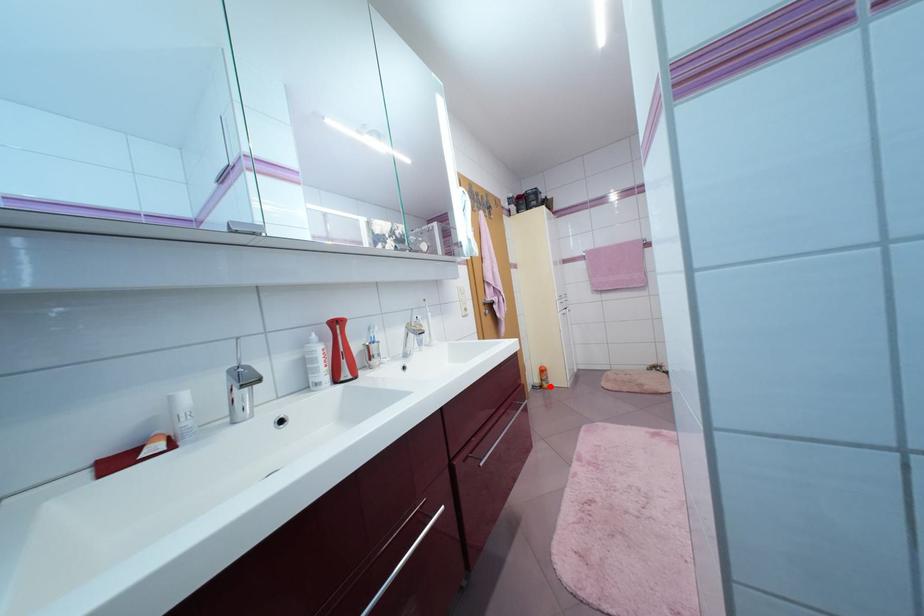
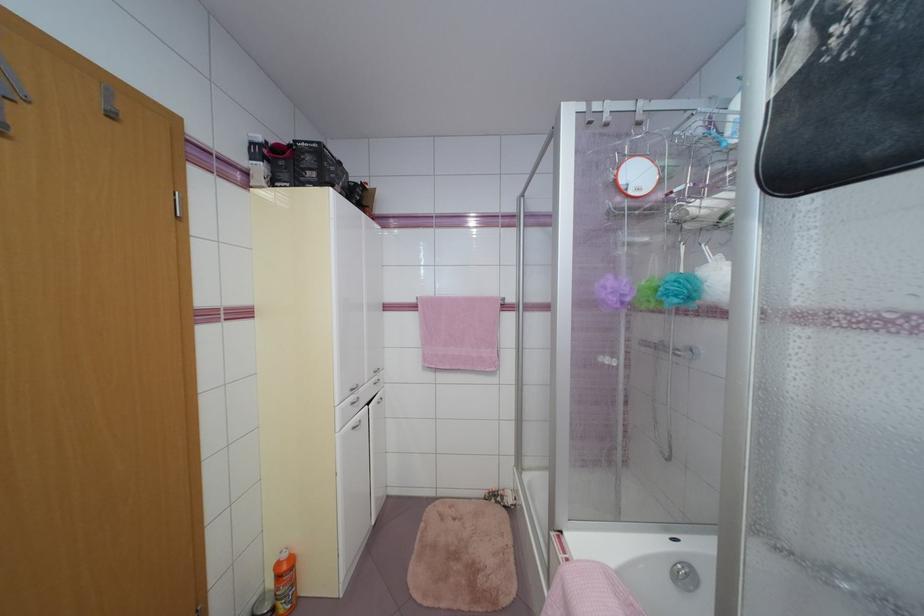
Question: I am providing you with two images of the same scene from different viewpoints. Image1 has a red point marked. In image2, the corresponding 3D location appears at what relative position? Reply with the corresponding letter.

Choices:
 (A) Closer
 (B) Farther

Answer: (A)